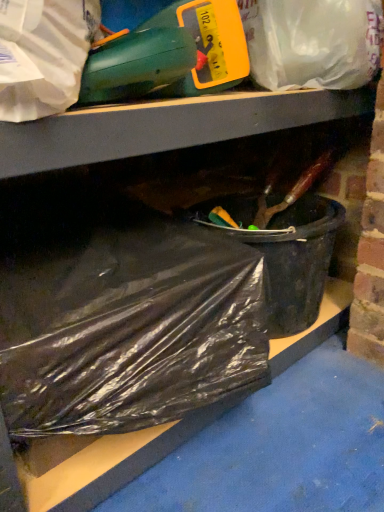
Question: From a real-world perspective, is translucent plastic bag at upper center, the first plastic bag when ordered from top to bottom, below black plastic bag at lower left, positioned as the 2th plastic bag in top-to-bottom order?

Choices:
 (A) yes
 (B) no

Answer: (B)

Question: From a real-world perspective, is translucent plastic bag at upper center, which is the 2th plastic bag in bottom-to-top order, located higher than black plastic bag at lower left, positioned as the 2th plastic bag in top-to-bottom order?

Choices:
 (A) yes
 (B) no

Answer: (A)

Question: Is translucent plastic bag at upper center, which is the 2th plastic bag in bottom-to-top order, far away from black plastic bag at lower left, positioned as the 2th plastic bag in top-to-bottom order?

Choices:
 (A) yes
 (B) no

Answer: (B)

Question: Does translucent plastic bag at upper center, which is the 2th plastic bag in bottom-to-top order, have a lesser height compared to black plastic bag at lower left, positioned as the 2th plastic bag in top-to-bottom order?

Choices:
 (A) yes
 (B) no

Answer: (A)

Question: From the image's perspective, is translucent plastic bag at upper center, the first plastic bag when ordered from top to bottom, on top of black plastic bag at lower left, positioned as the 2th plastic bag in top-to-bottom order?

Choices:
 (A) no
 (B) yes

Answer: (B)

Question: Do you think black plastic bag at lower left, the first plastic bag ordered from the bottom, is within translucent plastic bag at upper center, the first plastic bag when ordered from top to bottom, or outside of it?

Choices:
 (A) inside
 (B) outside

Answer: (B)

Question: In terms of width, does black plastic bag at lower left, the first plastic bag ordered from the bottom, look wider or thinner when compared to translucent plastic bag at upper center, which is the 2th plastic bag in bottom-to-top order?

Choices:
 (A) thin
 (B) wide

Answer: (B)

Question: Does point (188, 247) appear closer or farther from the camera than point (301, 24)?

Choices:
 (A) farther
 (B) closer

Answer: (B)

Question: Considering their positions, is black plastic bag at lower left, positioned as the 2th plastic bag in top-to-bottom order, located in front of or behind translucent plastic bag at upper center, which is the 2th plastic bag in bottom-to-top order?

Choices:
 (A) behind
 (B) front

Answer: (B)

Question: Is black plastic bag at lower left, the first plastic bag ordered from the bottom, inside the boundaries of black plastic bucket at lower right, or outside?

Choices:
 (A) outside
 (B) inside

Answer: (A)

Question: In terms of height, does black plastic bag at lower left, positioned as the 2th plastic bag in top-to-bottom order, look taller or shorter compared to black plastic bucket at lower right?

Choices:
 (A) tall
 (B) short

Answer: (A)

Question: Relative to black plastic bucket at lower right, is black plastic bag at lower left, the first plastic bag ordered from the bottom, in front or behind?

Choices:
 (A) front
 (B) behind

Answer: (A)

Question: Considering the positions of point 33,386 and point 221,201, is point 33,386 closer or farther from the camera than point 221,201?

Choices:
 (A) closer
 (B) farther

Answer: (A)

Question: In terms of height, does translucent plastic bag at upper center, the first plastic bag when ordered from top to bottom, look taller or shorter compared to black plastic bucket at lower right?

Choices:
 (A) tall
 (B) short

Answer: (B)

Question: Is point (271, 0) closer or farther from the camera than point (269, 281)?

Choices:
 (A) closer
 (B) farther

Answer: (A)